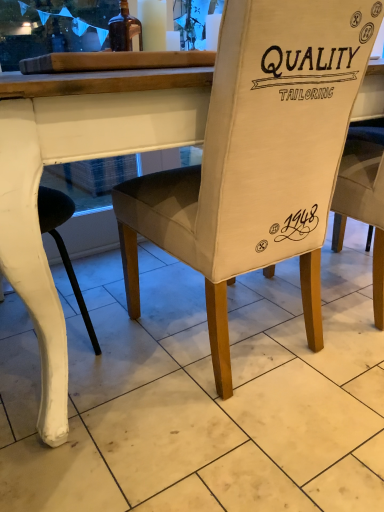
Question: Would you say beige fabric chair at center is part of brown glass bottle at upper left's contents?

Choices:
 (A) no
 (B) yes

Answer: (A)

Question: Would you consider brown glass bottle at upper left to be distant from beige fabric chair at center?

Choices:
 (A) yes
 (B) no

Answer: (B)

Question: Considering the relative sizes of brown glass bottle at upper left and beige fabric chair at center in the image provided, is brown glass bottle at upper left taller than beige fabric chair at center?

Choices:
 (A) no
 (B) yes

Answer: (A)

Question: Is brown glass bottle at upper left at the left side of beige fabric chair at center?

Choices:
 (A) no
 (B) yes

Answer: (B)

Question: Is brown glass bottle at upper left outside of beige fabric chair at center?

Choices:
 (A) no
 (B) yes

Answer: (B)

Question: Considering the relative positions of brown glass bottle at upper left and beige fabric chair at center in the image provided, is brown glass bottle at upper left to the right of beige fabric chair at center from the viewer's perspective?

Choices:
 (A) no
 (B) yes

Answer: (A)

Question: Is beige fabric chair at center aimed at brown glass bottle at upper left?

Choices:
 (A) no
 (B) yes

Answer: (B)

Question: Does beige fabric chair at center appear on the right side of brown glass bottle at upper left?

Choices:
 (A) yes
 (B) no

Answer: (A)

Question: From a real-world perspective, is beige fabric chair at center located higher than brown glass bottle at upper left?

Choices:
 (A) no
 (B) yes

Answer: (A)

Question: Are beige fabric chair at center and brown glass bottle at upper left located far from each other?

Choices:
 (A) yes
 (B) no

Answer: (B)

Question: Does beige fabric chair at center have a lesser width compared to brown glass bottle at upper left?

Choices:
 (A) yes
 (B) no

Answer: (B)

Question: Does beige fabric chair at center have a larger size compared to brown glass bottle at upper left?

Choices:
 (A) yes
 (B) no

Answer: (A)

Question: In terms of height, does beige fabric chair at center look taller or shorter compared to brown glass bottle at upper left?

Choices:
 (A) short
 (B) tall

Answer: (B)